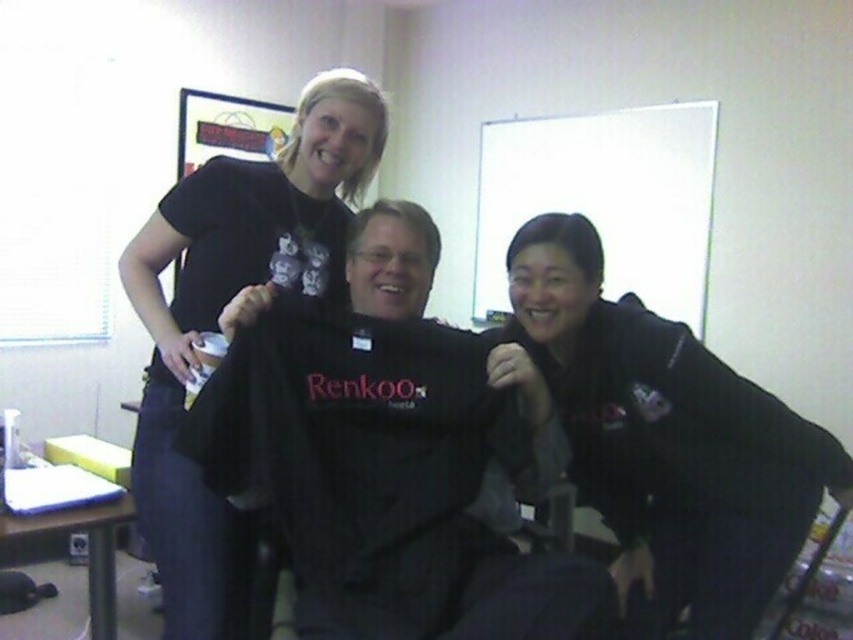
You are a tailor measuring for alterations. You see the black fabric shirt at center and the black fleece jacket at lower right. Which item has a shorter height?

The black fabric shirt at center has a lesser height compared to the black fleece jacket at lower right, so the black fabric shirt at center is shorter in height.

You are organizing a photoshoot and need to arrange the black fabric shirt at center and the black fleece jacket at lower right in a way that maintains their original positions relative to each other. If you want to move both items to the left side of the frame, which item should be placed further to the left to keep their spatial relationship intact?

The black fabric shirt at center should be placed further to the left than the black fleece jacket at lower right because it was originally positioned to the left of the jacket, so maintaining that leftward relationship ensures their spatial arrangement remains consistent.